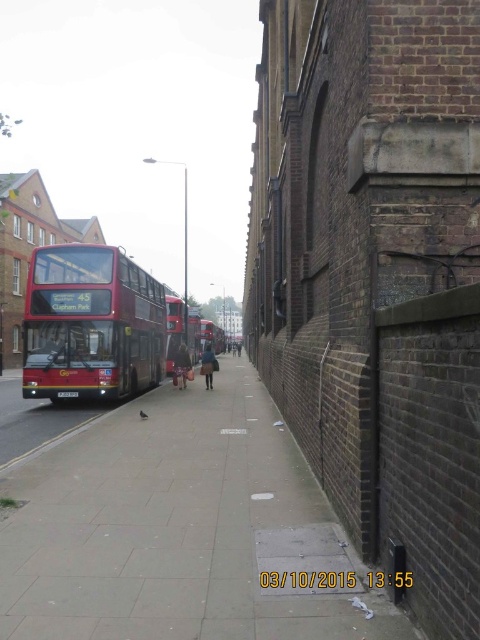
Question: Which point is farther to the camera?

Choices:
 (A) smooth concrete pavement at center
 (B) dark blue fabric coat at center
 (C) dark brown leather coat at center
 (D) red matte bus at center

Answer: (D)

Question: Is smooth concrete pavement at center above red matte bus at center?

Choices:
 (A) yes
 (B) no

Answer: (B)

Question: Which of the following is the closest to the observer?

Choices:
 (A) smooth concrete pavement at center
 (B) red matte bus at center
 (C) dark blue fabric coat at center
 (D) dark brown leather coat at center

Answer: (A)

Question: Can you confirm if smooth concrete pavement at center is smaller than red matte double-decker bus at left?

Choices:
 (A) no
 (B) yes

Answer: (B)

Question: Can you confirm if dark blue fabric coat at center is positioned to the left of dark brown leather coat at center?

Choices:
 (A) yes
 (B) no

Answer: (A)

Question: Among these points, which one is farthest from the camera?

Choices:
 (A) (84, 323)
 (B) (203, 356)

Answer: (B)